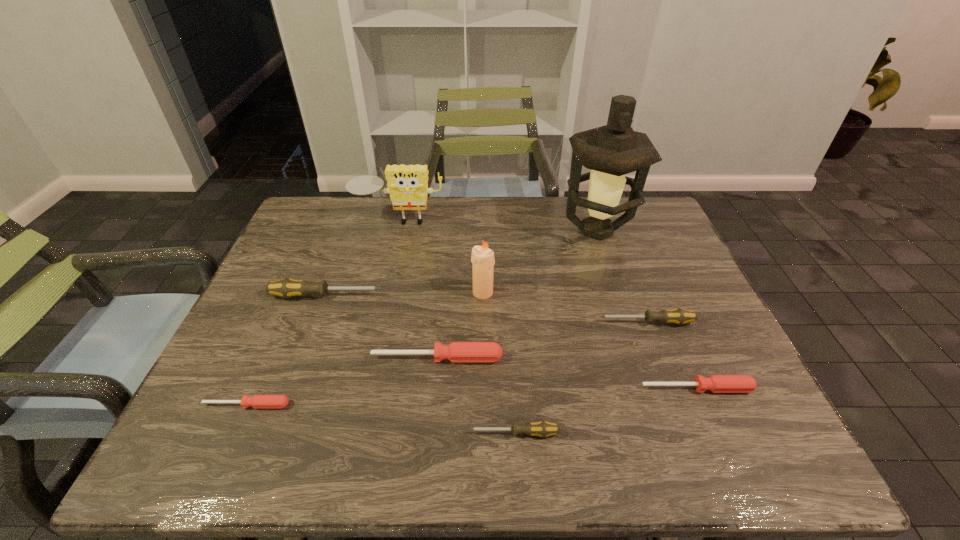
The image size is (960, 540). What are the coordinates of `vacant space situated at the tip of the fifth nearest object` in the screenshot? It's located at (545, 322).

At what (x,y) coordinates should I click in order to perform the action: click on free location located at the tip of the fifth nearest object. Please return your answer as a coordinate pair (x, y). Image resolution: width=960 pixels, height=540 pixels. Looking at the image, I should click on (545, 322).

Find the location of `free spot located 0.090m on the right of the farthest red screwdriver`. free spot located 0.090m on the right of the farthest red screwdriver is located at coordinates (541, 358).

This screenshot has width=960, height=540. Find the location of `vacant space located on the left of the rightmost red screwdriver`. vacant space located on the left of the rightmost red screwdriver is located at coordinates (581, 388).

Where is `blank space located 0.310m at the tip of the nearest object`? This screenshot has width=960, height=540. blank space located 0.310m at the tip of the nearest object is located at coordinates (313, 433).

The height and width of the screenshot is (540, 960). Identify the location of free space located at the tip of the nearest object. (299, 433).

Where is `free spot located at the tip of the nearest object`? This screenshot has width=960, height=540. free spot located at the tip of the nearest object is located at coordinates (324, 433).

Find the location of a particular element. vacant position located on the right of the shortest screwdriver is located at coordinates (457, 405).

This screenshot has height=540, width=960. Identify the location of oil lamp located in the far edge section of the desktop. (611, 151).

What are the coordinates of `sponge located in the far edge section of the desktop` in the screenshot? It's located at (407, 185).